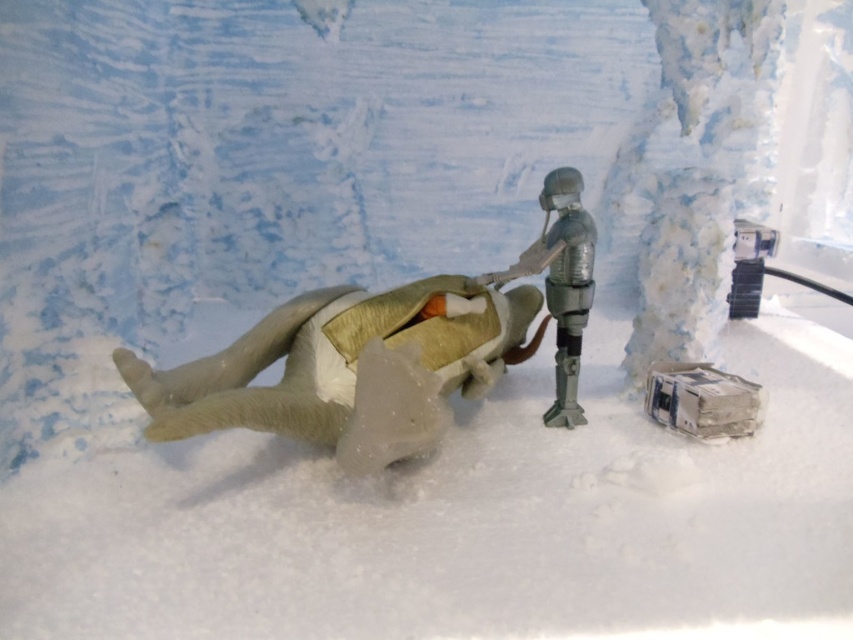
Question: Which point is farther from the camera taking this photo?

Choices:
 (A) (570, 323)
 (B) (325, 426)

Answer: (A)

Question: From the image, what is the correct spatial relationship of fuzzy gray animal at center in relation to metallic silver figure at center?

Choices:
 (A) below
 (B) above

Answer: (A)

Question: Does fuzzy gray animal at center have a smaller size compared to metallic silver figure at center?

Choices:
 (A) no
 (B) yes

Answer: (A)

Question: From the image, what is the correct spatial relationship of fuzzy gray animal at center in relation to metallic silver figure at center?

Choices:
 (A) below
 (B) above

Answer: (A)